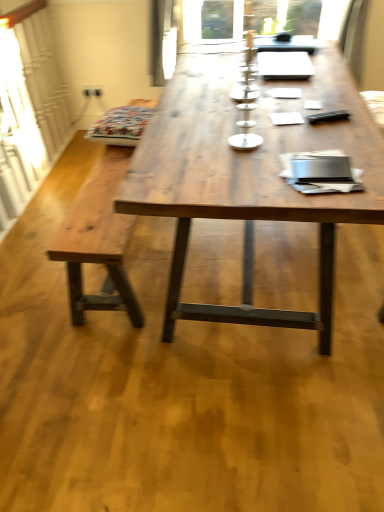
Locate an element on the screen. free space in front of wooden bench at left is located at coordinates (156, 373).